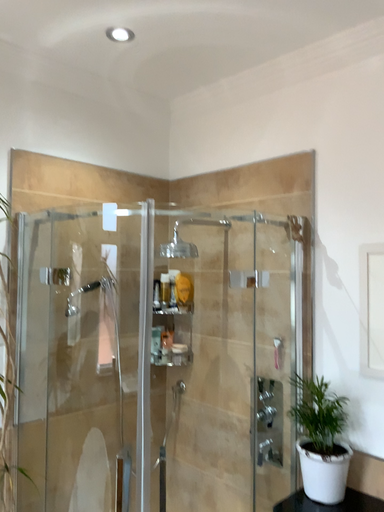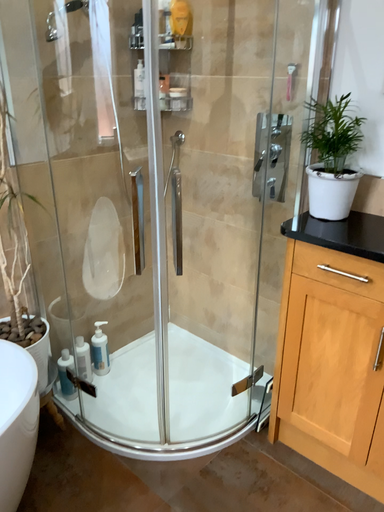
Question: Which way did the camera rotate in the video?

Choices:
 (A) rotated downward
 (B) rotated upward

Answer: (A)